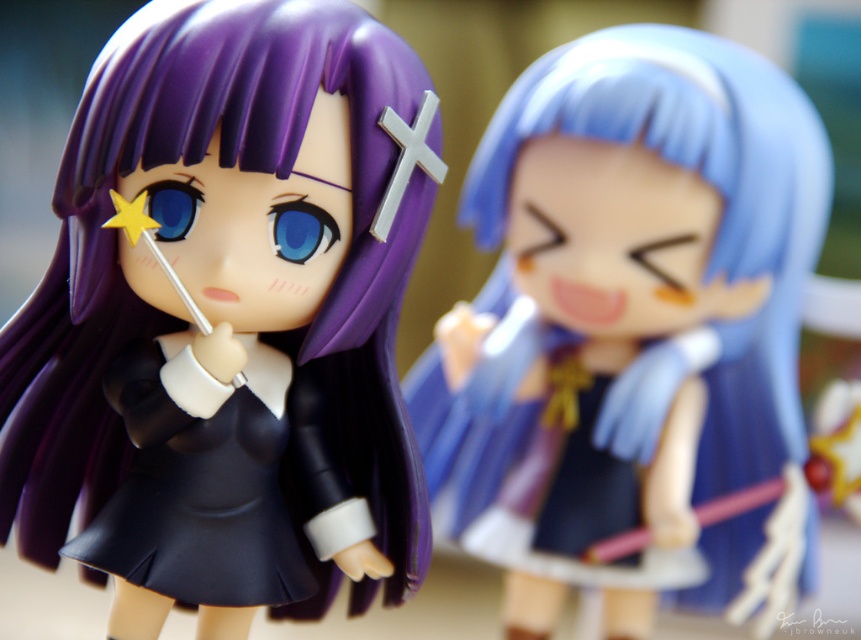
You are organizing a display for a collector who wants to arrange the two figurines so that the smaller one is placed in front for visibility. Given the matte black dress at center and the satin blue dress at right, which figurine should be positioned in front?

The matte black dress at center should be placed in front because it has a smaller size compared to the satin blue dress at right, ensuring it remains visible without being overshadowed by the larger one.

You are designing a display case for two figurines. The first has a matte black dress at center and the second has a satin blue dress at right. Which figurine should you place closer to the front of the display case to ensure both are visible?

The matte black dress at center is thinner than the satin blue dress at right, so placing the thinner matte black dress at center closer to the front will allow both figurines to be seen without obstruction.